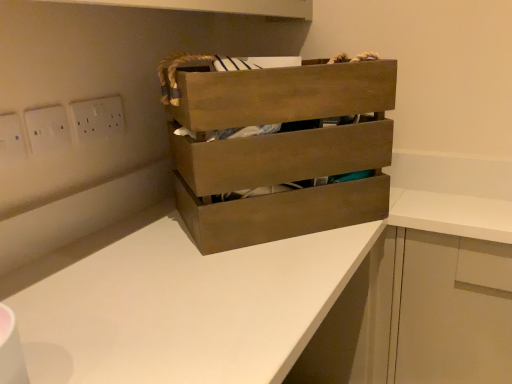
Question: Is white plastic switch at upper left, positioned as the 2th electric outlet in back-to-front order, not inside white matte cabinet at lower right?

Choices:
 (A) no
 (B) yes

Answer: (B)

Question: Does white plastic switch at upper left, the second electric outlet when ordered from right to left, have a lesser width compared to white matte cabinet at lower right?

Choices:
 (A) no
 (B) yes

Answer: (B)

Question: Does white plastic switch at upper left, the second electric outlet when ordered from right to left, have a larger size compared to white matte cabinet at lower right?

Choices:
 (A) yes
 (B) no

Answer: (B)

Question: From a real-world perspective, is white plastic switch at upper left, the second electric outlet when ordered from right to left, beneath white matte cabinet at lower right?

Choices:
 (A) no
 (B) yes

Answer: (A)

Question: Is white plastic switch at upper left, the 2th electric outlet in the left-to-right sequence, to the left of white matte cabinet at lower right from the viewer's perspective?

Choices:
 (A) yes
 (B) no

Answer: (A)

Question: Is white plastic switch at upper left, positioned as the 2th electric outlet in back-to-front order, smaller than white matte cabinet at lower right?

Choices:
 (A) yes
 (B) no

Answer: (A)

Question: Is white plastic electric outlet at upper left, acting as the first electric outlet starting from the back, wider than white matte cabinet at lower right?

Choices:
 (A) yes
 (B) no

Answer: (B)

Question: Is white plastic electric outlet at upper left, the first electric outlet viewed from the right, further to the viewer compared to white matte cabinet at lower right?

Choices:
 (A) yes
 (B) no

Answer: (A)

Question: Is white plastic electric outlet at upper left, placed as the third electric outlet when sorted from left to right, at the right side of white matte cabinet at lower right?

Choices:
 (A) no
 (B) yes

Answer: (A)

Question: Can we say white plastic electric outlet at upper left, which ranks as the third electric outlet in front-to-back order, lies outside white matte cabinet at lower right?

Choices:
 (A) yes
 (B) no

Answer: (A)

Question: Considering the relative positions of white plastic electric outlet at upper left, the first electric outlet viewed from the right, and white matte cabinet at lower right in the image provided, is white plastic electric outlet at upper left, the first electric outlet viewed from the right, in front of white matte cabinet at lower right?

Choices:
 (A) no
 (B) yes

Answer: (A)

Question: Is white plastic electric outlet at upper left, acting as the first electric outlet starting from the back, directly adjacent to white matte cabinet at lower right?

Choices:
 (A) yes
 (B) no

Answer: (B)

Question: From a real-world perspective, is white matte counter at center over white matte cabinet at lower right?

Choices:
 (A) yes
 (B) no

Answer: (B)